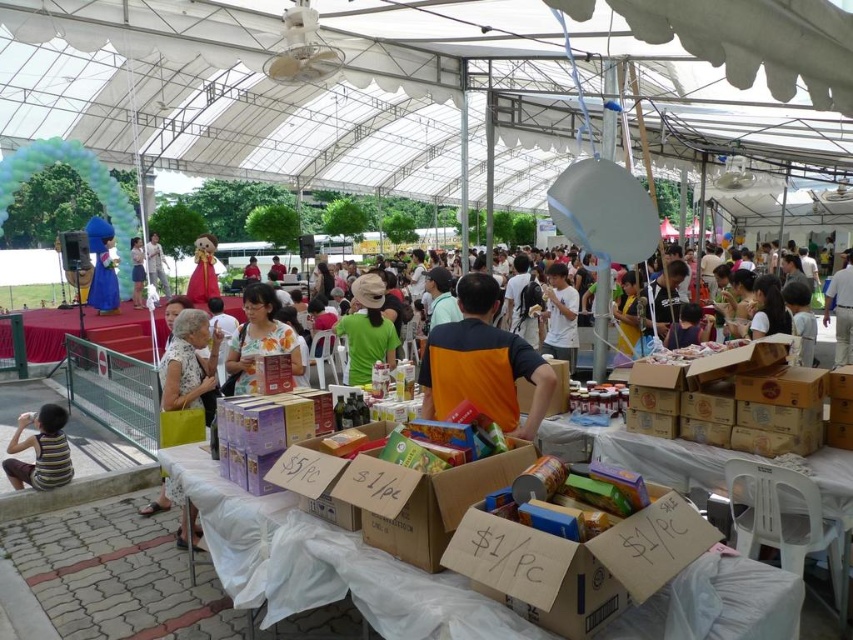
Which of these two, cardboard boxes at lower right or green matte shirt at center, stands taller?

green matte shirt at center is taller.

Consider the image. Can you confirm if cardboard boxes at lower right is positioned to the left of green matte shirt at center?

Incorrect, cardboard boxes at lower right is not on the left side of green matte shirt at center.

I want to click on cardboard boxes at lower right, so click(642, 454).

Does white matte shirt at center appear under light brown fabric dress at center?

Correct, white matte shirt at center is located below light brown fabric dress at center.

Is white matte shirt at center positioned behind light brown fabric dress at center?

No, white matte shirt at center is closer to the viewer.

Is point (572, 312) farther from viewer compared to point (142, 301)?

No.

The width and height of the screenshot is (853, 640). I want to click on white matte shirt at center, so click(x=560, y=316).

Is orange fabric shirt at center closer to the viewer compared to white cotton dress at center?

Yes, orange fabric shirt at center is in front of white cotton dress at center.

Is orange fabric shirt at center to the left of white cotton dress at center from the viewer's perspective?

No, orange fabric shirt at center is not to the left of white cotton dress at center.

Between point (480, 369) and point (152, 280), which one is positioned in front?

Point (480, 369) is more forward.

In order to click on orange fabric shirt at center in this screenshot , I will do `click(482, 364)`.